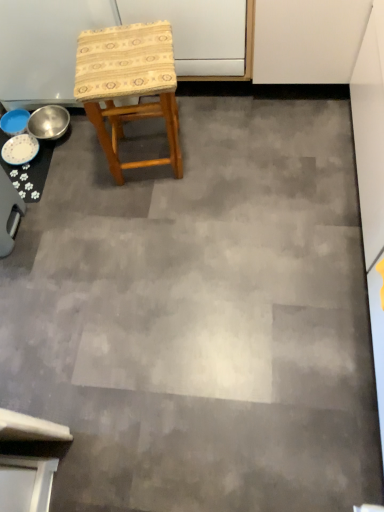
Identify the location of space that is in front of woven fabric stool at center. (162, 212).